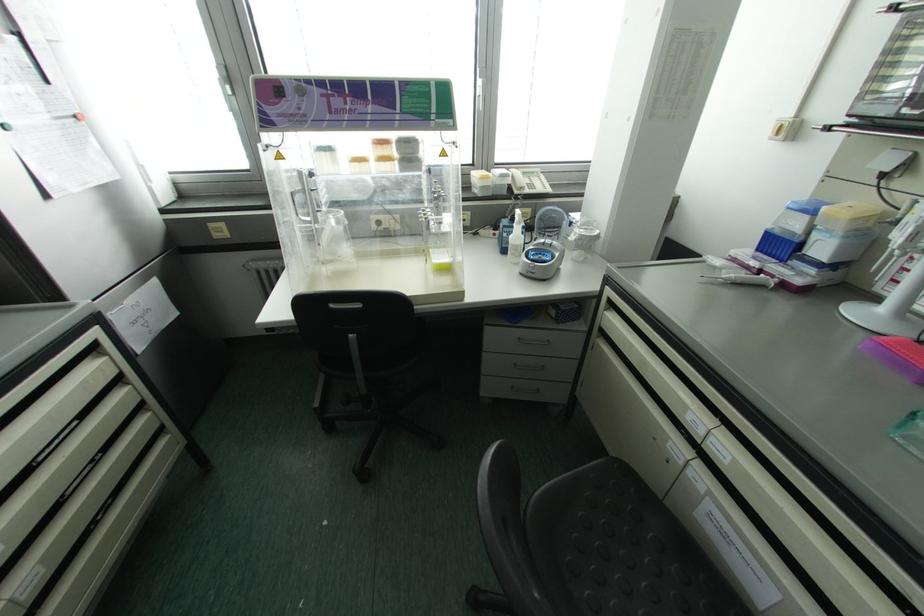
The width and height of the screenshot is (924, 616). What do you see at coordinates (351, 103) in the screenshot?
I see `a clear machine lid` at bounding box center [351, 103].